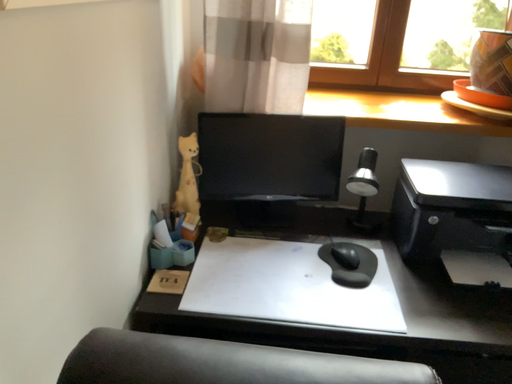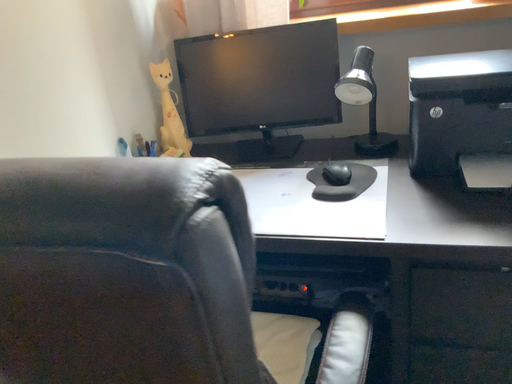
Question: Which way did the camera rotate in the video?

Choices:
 (A) rotated right
 (B) rotated left

Answer: (B)